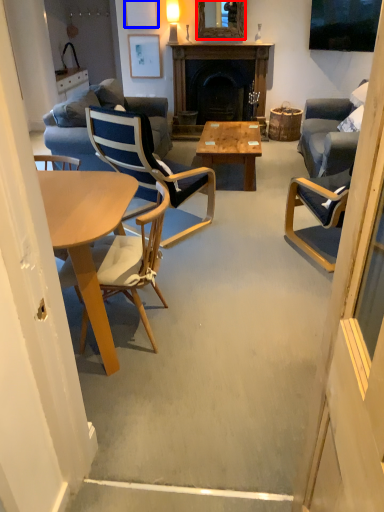
Question: Which object is closer to the camera taking this photo, mirror (highlighted by a red box) or picture frame (highlighted by a blue box)?

Choices:
 (A) mirror
 (B) picture frame

Answer: (A)